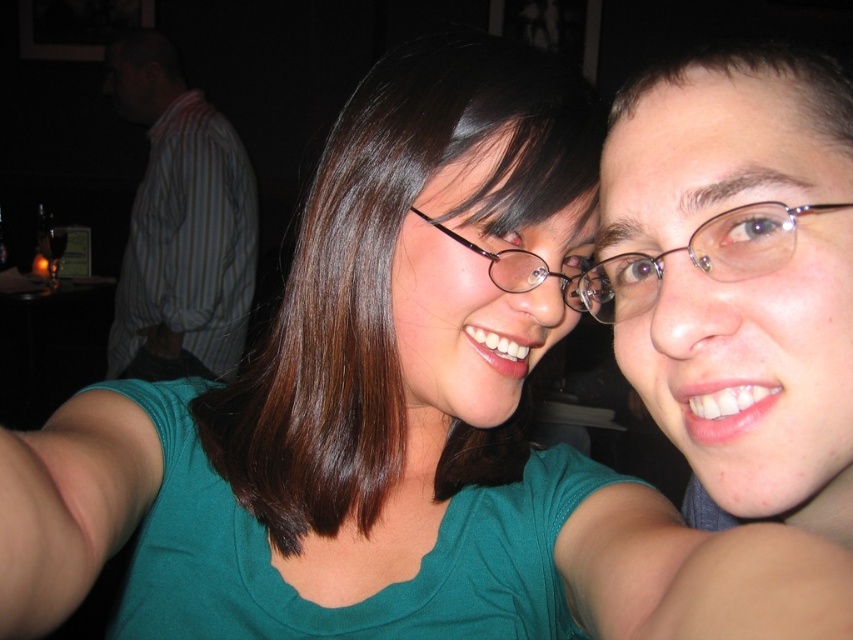
Question: Does pink flesh at lower right appear over matte black glasses at center?

Choices:
 (A) no
 (B) yes

Answer: (A)

Question: Estimate the real-world distances between objects in this image. Which object is closer to the pink flesh at lower right?

Choices:
 (A) striped shirt at upper left
 (B) clear plastic glasses at center

Answer: (B)

Question: Estimate the real-world distances between objects in this image. Which object is farther from the matte black glasses at center?

Choices:
 (A) striped shirt at upper left
 (B) brown hair at center
 (C) clear plastic glasses at center
 (D) brown hair at upper right

Answer: (A)

Question: Does striped shirt at upper left have a smaller size compared to brown hair at upper right?

Choices:
 (A) no
 (B) yes

Answer: (A)

Question: Which of the following is the farthest from the observer?

Choices:
 (A) (685, 612)
 (B) (531, 275)
 (C) (288, 412)
 (D) (581, 285)

Answer: (C)

Question: Is brown hair at center behind matte black glasses at center?

Choices:
 (A) no
 (B) yes

Answer: (B)